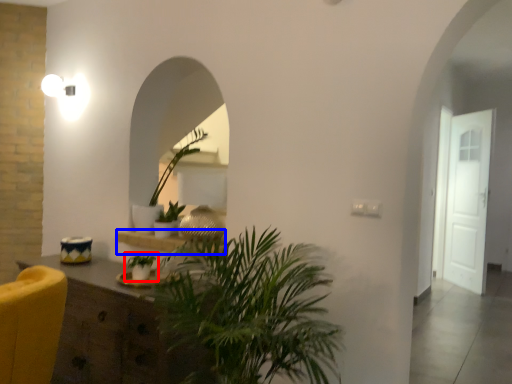
Question: Among these objects, which one is farthest to the camera, houseplant (highlighted by a red box) or shelf (highlighted by a blue box)?

Choices:
 (A) houseplant
 (B) shelf

Answer: (B)